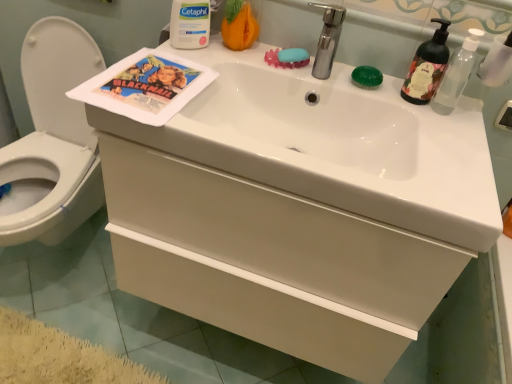
Identify the location of vacant region in front of translucent plastic pump bottle at upper right. (453, 140).